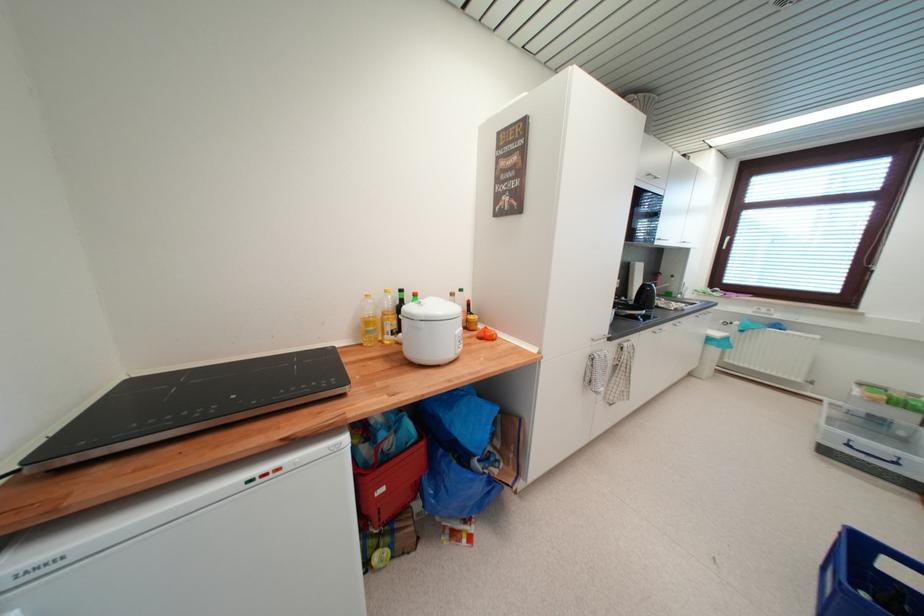
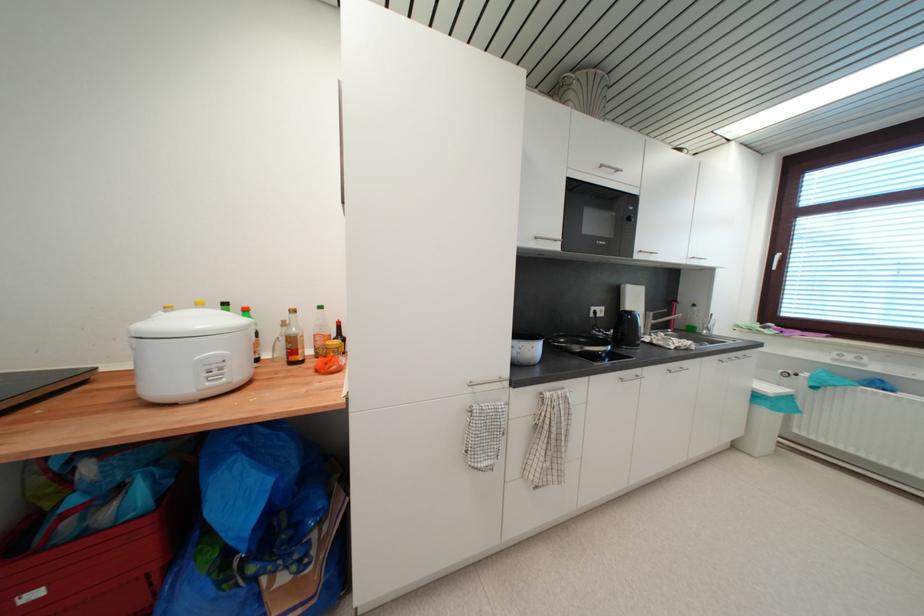
Question: Based on the continuous images, in which direction is the camera rotating? Reply with the corresponding letter.

Choices:
 (A) Left
 (B) Right
 (C) Up
 (D) Down

Answer: (A)